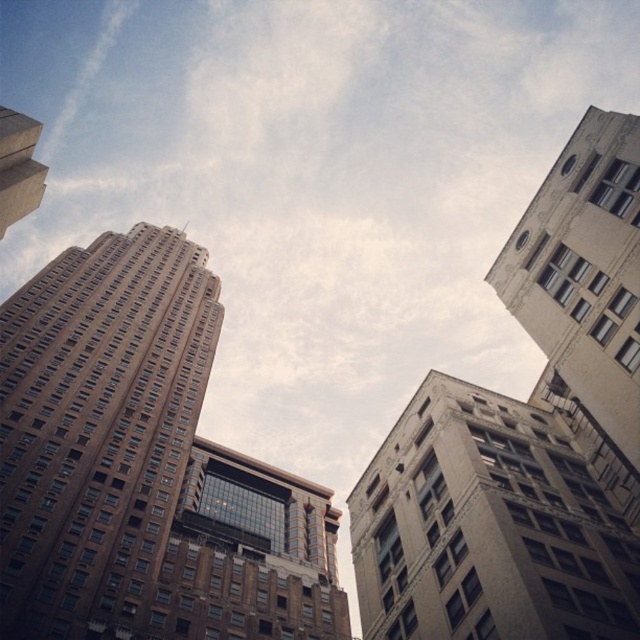
Question: Which point appears closest to the camera in this image?

Choices:
 (A) (3, 221)
 (B) (588, 536)
 (C) (83, 547)

Answer: (A)

Question: Among these objects, which one is nearest to the camera?

Choices:
 (A) gray concrete building at center
 (B) brown brick building at center

Answer: (A)

Question: Which point is farther to the camera?

Choices:
 (A) (573, 440)
 (B) (13, 170)
 (C) (202, 310)

Answer: (C)

Question: Observing the image, what is the correct spatial positioning of brown brick building at center in reference to gray concrete building at center?

Choices:
 (A) above
 (B) below

Answer: (A)

Question: Can you confirm if brown brick building at center is bigger than matte brown building at upper left?

Choices:
 (A) yes
 (B) no

Answer: (A)

Question: In this image, where is brown brick building at center located relative to matte brown building at upper left?

Choices:
 (A) right
 (B) left

Answer: (B)